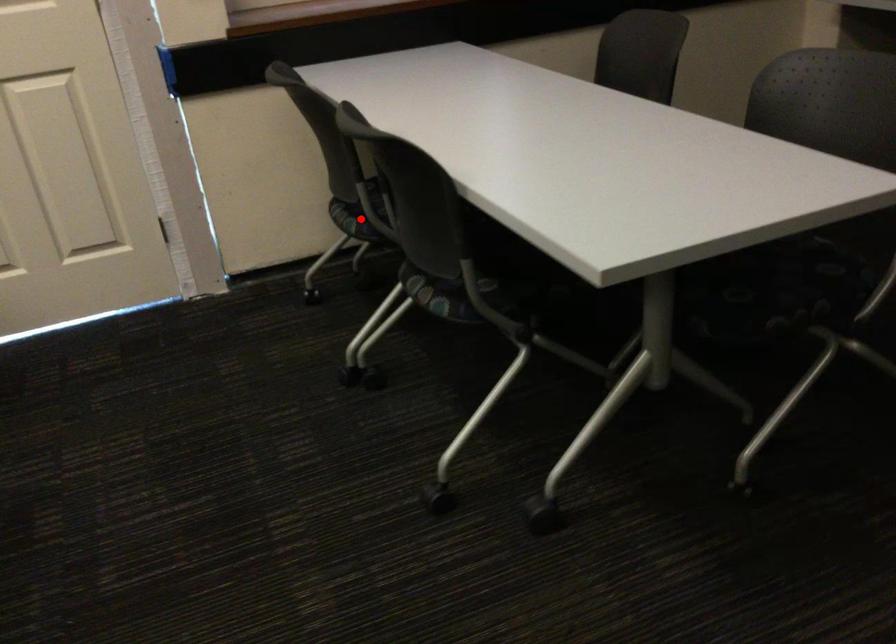
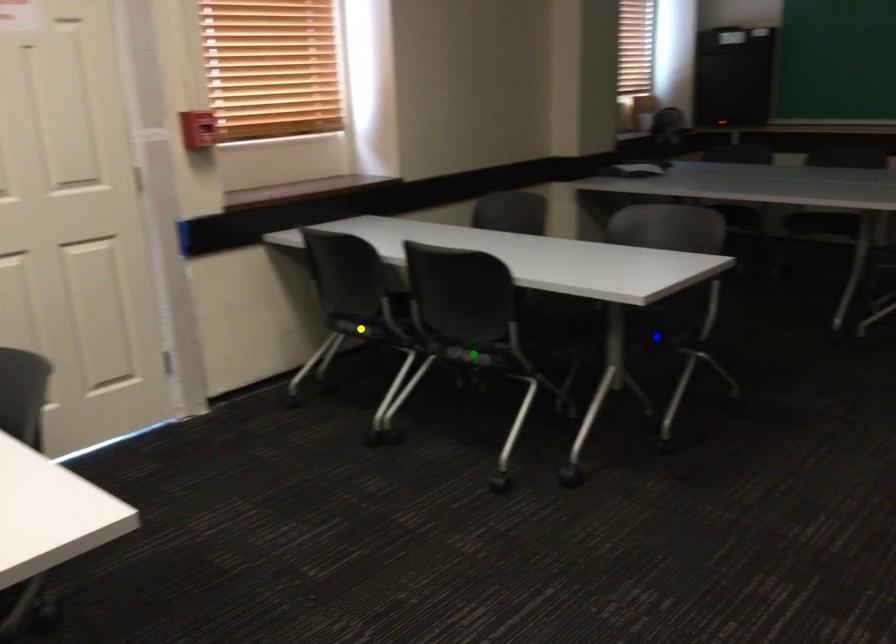
Question: I am providing you with two images of the same scene from different viewpoints. A red point is marked on the first image. You are given multiple points on the second image. Which spot in image 2 lines up with the point in image 1?

Choices:
 (A) green point
 (B) blue point
 (C) yellow point

Answer: (C)